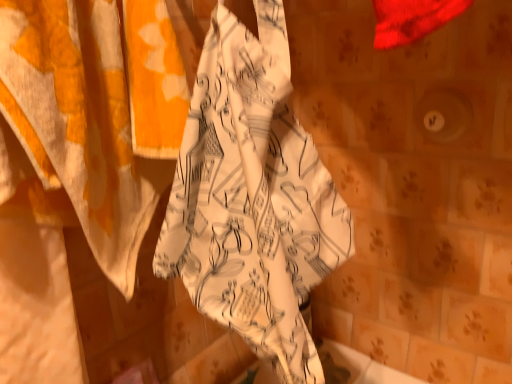
Question: Considering the relative sizes of white printed towel at center and white printed fabric at left in the image provided, is white printed towel at center bigger than white printed fabric at left?

Choices:
 (A) no
 (B) yes

Answer: (A)

Question: Does white printed towel at center lie behind white printed fabric at left?

Choices:
 (A) yes
 (B) no

Answer: (A)

Question: Is white printed towel at center taller than white printed fabric at left?

Choices:
 (A) no
 (B) yes

Answer: (A)

Question: Is white printed towel at center turned away from white printed fabric at left?

Choices:
 (A) yes
 (B) no

Answer: (B)

Question: Is white printed towel at center to the right of white printed fabric at left from the viewer's perspective?

Choices:
 (A) no
 (B) yes

Answer: (B)

Question: Is white printed towel at center thinner than white printed fabric at left?

Choices:
 (A) no
 (B) yes

Answer: (A)

Question: Could you tell me if white printed fabric at left is turned towards white printed towel at center?

Choices:
 (A) yes
 (B) no

Answer: (A)

Question: Can you confirm if white printed fabric at left is taller than white printed towel at center?

Choices:
 (A) yes
 (B) no

Answer: (A)

Question: Is white printed fabric at left outside of white printed towel at center?

Choices:
 (A) yes
 (B) no

Answer: (A)

Question: From the image's perspective, is white printed fabric at left over white printed towel at center?

Choices:
 (A) yes
 (B) no

Answer: (B)

Question: Considering the relative positions of white printed fabric at left and white printed towel at center in the image provided, is white printed fabric at left to the left of white printed towel at center from the viewer's perspective?

Choices:
 (A) yes
 (B) no

Answer: (A)

Question: Is white printed towel at center located within white printed fabric at left?

Choices:
 (A) no
 (B) yes

Answer: (A)

Question: Considering the positions of point (266, 218) and point (124, 274), is point (266, 218) closer or farther from the camera than point (124, 274)?

Choices:
 (A) closer
 (B) farther

Answer: (A)